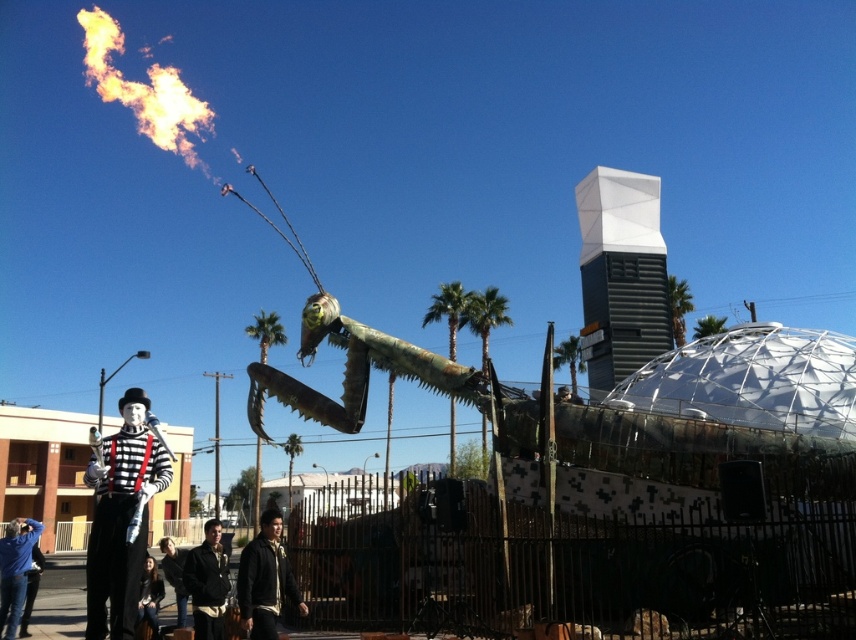
You are standing at the center of the image and want to walk towards the point labeled as point (122, 516). Which direction should you move relative to the silver metallic clown at lower left?

The point (122, 516) is located on the silver metallic clown at lower left, so you should move towards the lower left direction to reach it.

You are a photographer trying to capture both the silver metallic clown at lower left and the dark gray jacket at center in a single frame. Which object should you focus on first to ensure both are in the frame?

The silver metallic clown at lower left is taller than the dark gray jacket at center. To ensure both are in the frame, focus on the silver metallic clown at lower left first as it requires more vertical space.